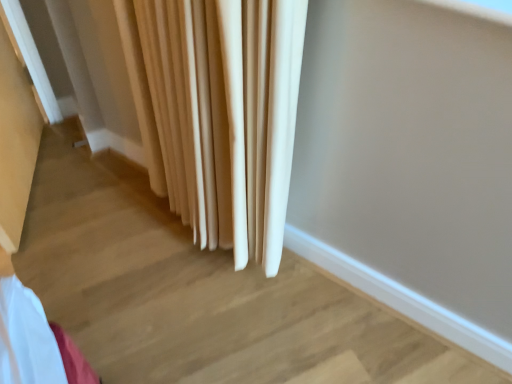
What is the approximate height of beige fabric curtain at lower left?

It is 3.30 feet.

Where is `beige fabric curtain at lower left`? The height and width of the screenshot is (384, 512). beige fabric curtain at lower left is located at coordinates (219, 113).

Describe the element at coordinates (219, 113) in the screenshot. I see `beige fabric curtain at lower left` at that location.

Find the location of a particular element. beige fabric curtain at lower left is located at coordinates (219, 113).